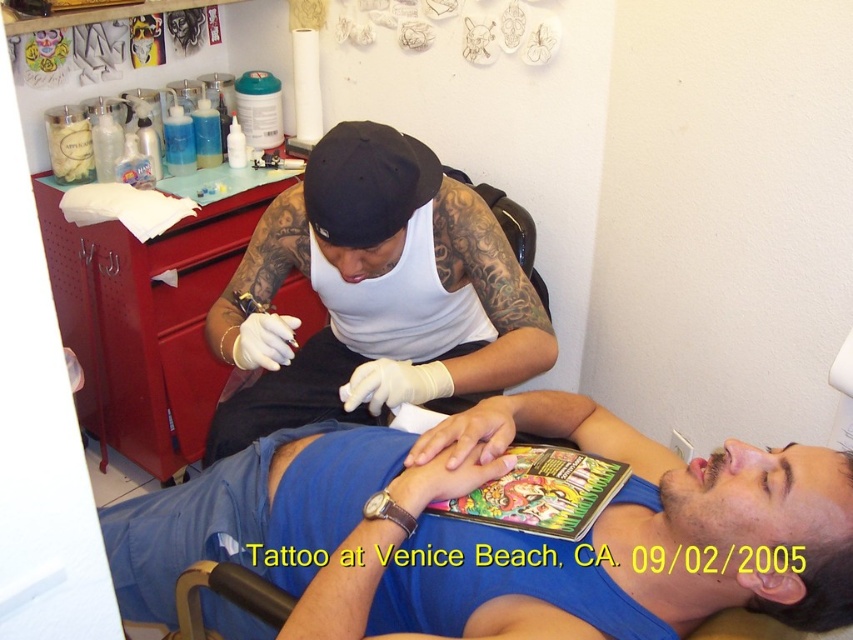
Looking at this image, does blue fabric at lower center have a larger size compared to white matte tank top at upper center?

Actually, blue fabric at lower center might be smaller than white matte tank top at upper center.

Can you confirm if blue fabric at lower center is positioned above white matte tank top at upper center?

No, blue fabric at lower center is not above white matte tank top at upper center.

Identify the location of blue fabric at lower center. The width and height of the screenshot is (853, 640). (500, 532).

This screenshot has width=853, height=640. Identify the location of blue fabric at lower center. (500, 532).